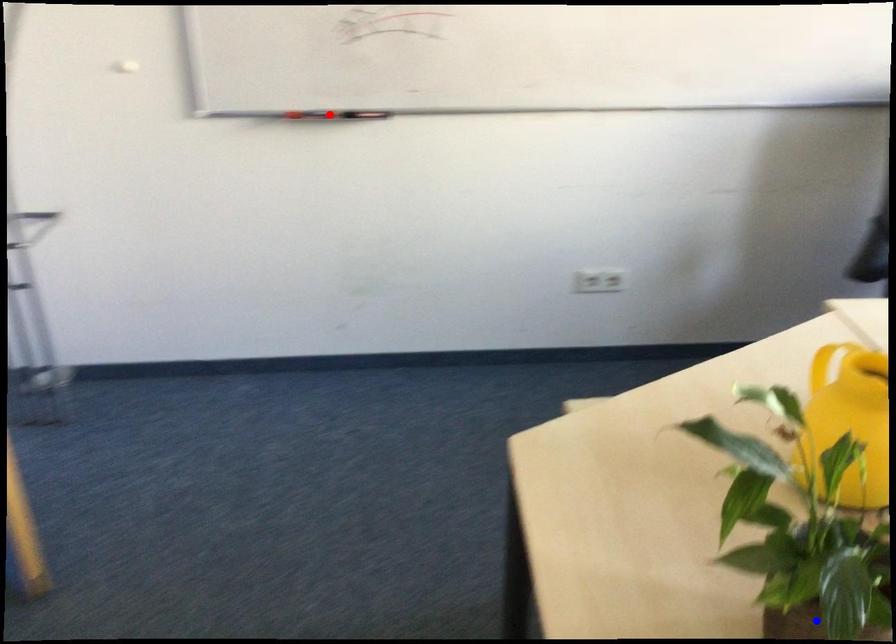
Question: In the image, two points are highlighted. Which point is nearer to the camera? Reply with the corresponding letter.

Choices:
 (A) blue point
 (B) red point

Answer: (A)